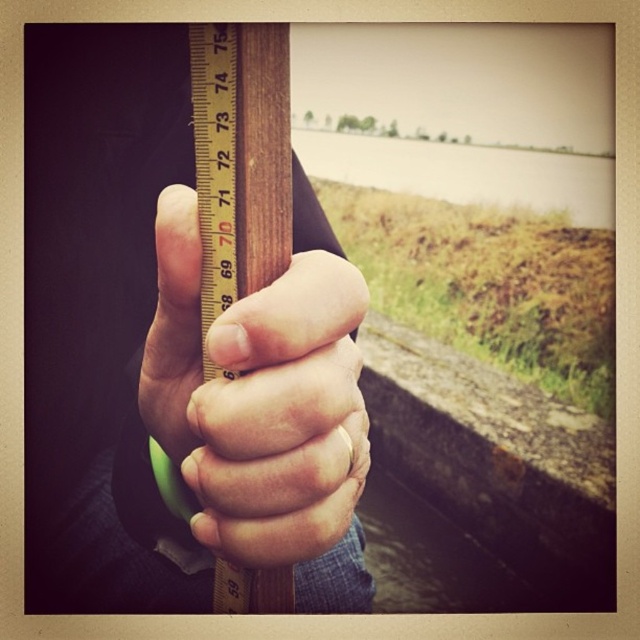
Does matte wood ruler at center appear on the left side of wooden ruler at center?

Yes, matte wood ruler at center is to the left of wooden ruler at center.

Does matte wood ruler at center have a smaller size compared to wooden ruler at center?

Actually, matte wood ruler at center might be larger than wooden ruler at center.

Does point (104, 216) come in front of point (193, 65)?

No, it is behind (193, 65).

This screenshot has width=640, height=640. In order to click on matte wood ruler at center in this screenshot , I will do `click(170, 355)`.

Does matte wood ruler at center have a lesser height compared to matte wood hand at center?

Incorrect, matte wood ruler at center's height does not fall short of matte wood hand at center's.

Does matte wood ruler at center appear under matte wood hand at center?

No.

The image size is (640, 640). Find the location of `matte wood ruler at center`. matte wood ruler at center is located at coordinates (170, 355).

Between matte wood hand at center and wooden ruler at center, which one is positioned lower?

matte wood hand at center is lower down.

The image size is (640, 640). In order to click on matte wood hand at center in this screenshot , I will do `click(259, 397)`.